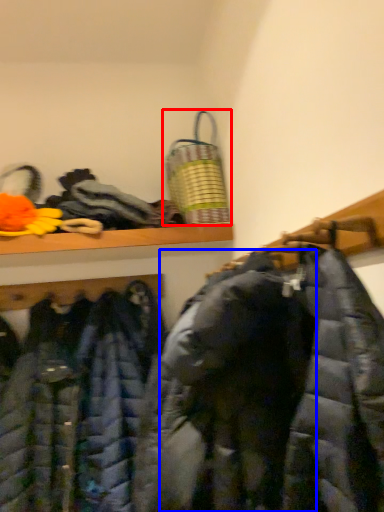
Question: Which object is further to the camera taking this photo, laundry basket (highlighted by a red box) or cloak (highlighted by a blue box)?

Choices:
 (A) laundry basket
 (B) cloak

Answer: (A)